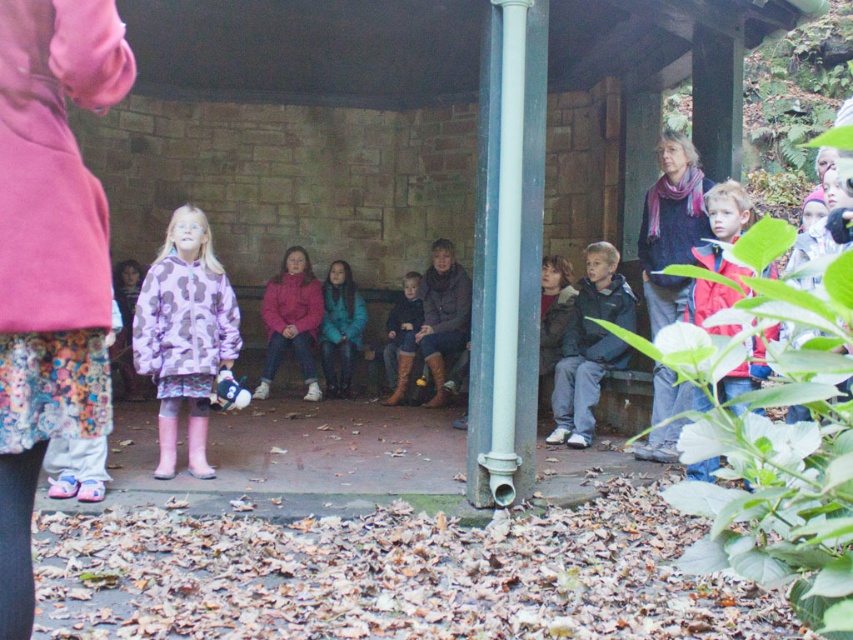
You are standing in the outdoor shelter and want to greet the person wearing the dark blue sweater at right. Which direction should you move relative to the floral skirt at lower left?

The floral skirt at lower left is to the left of the dark blue sweater at right, so you should move to the right from the floral skirt at lower left to reach the dark blue sweater at right.

Based on the photo, you are standing in the outdoor shelter and want to find the purple printed jacket at center. Which direction should you look relative to the red matte jacket at right?

The purple printed jacket at center is located below the red matte jacket at right, so you should look downward from the red matte jacket at right to find it.